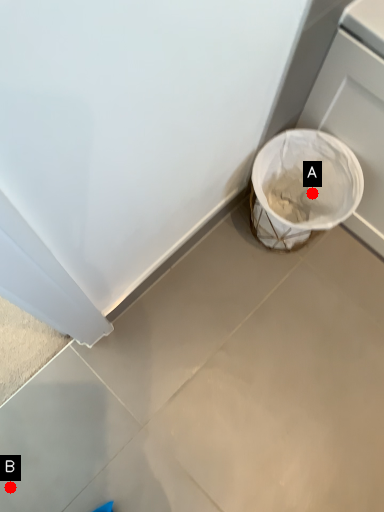
Question: Two points are circled on the image, labeled by A and B beside each circle. Among these points, which one is farthest from the camera?

Choices:
 (A) A is further
 (B) B is further

Answer: (A)